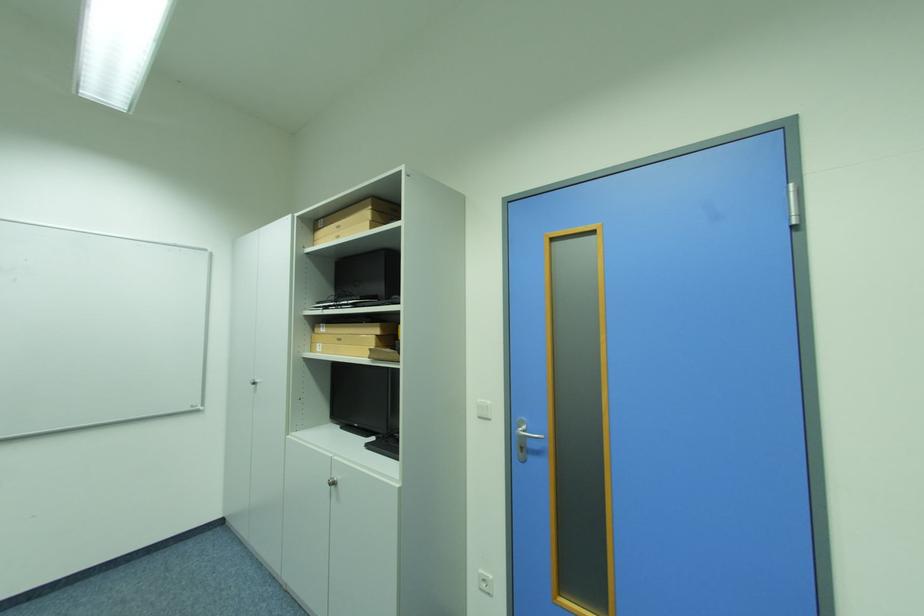
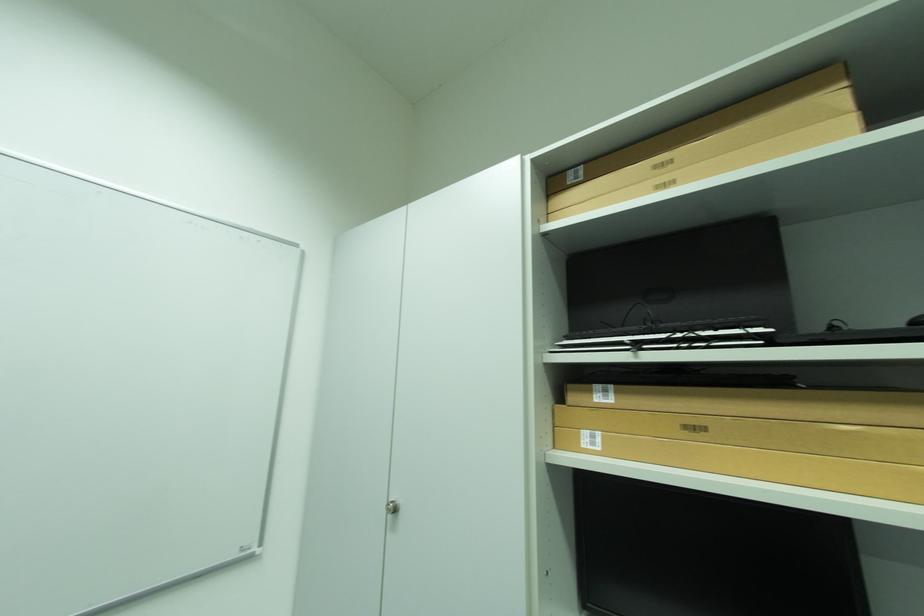
In the second image, find the point that corresponds to point 331,328 in the first image.

(614, 392)